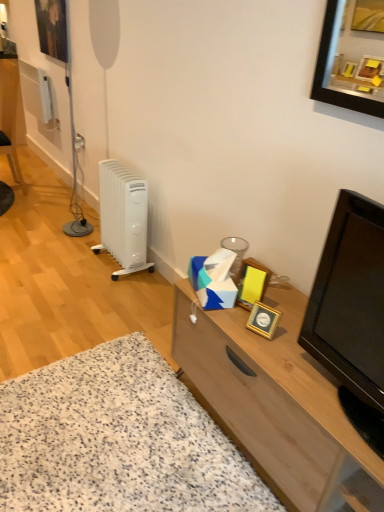
Question: Should I look upward or downward to see white plastic radiator at left?

Choices:
 (A) down
 (B) up

Answer: (B)

Question: Is the position of black glossy television at right less distant than that of white plastic radiator at left?

Choices:
 (A) no
 (B) yes

Answer: (B)

Question: Is black glossy television at right aimed at white plastic radiator at left?

Choices:
 (A) no
 (B) yes

Answer: (A)

Question: Is black glossy television at right not close to white plastic radiator at left?

Choices:
 (A) no
 (B) yes

Answer: (B)

Question: From the image's perspective, is black glossy television at right located beneath white plastic radiator at left?

Choices:
 (A) yes
 (B) no

Answer: (A)

Question: Does black glossy television at right appear on the left side of white plastic radiator at left?

Choices:
 (A) no
 (B) yes

Answer: (A)

Question: Is black glossy television at right further to camera compared to white plastic radiator at left?

Choices:
 (A) no
 (B) yes

Answer: (A)

Question: Is matte black picture frame at upper left, marked as the 1th picture frame in a left-to-right arrangement, facing towards gold metallic picture frame at center-right, the 2th picture frame when ordered from top to bottom?

Choices:
 (A) no
 (B) yes

Answer: (A)

Question: Does matte black picture frame at upper left, which is counted as the 3th picture frame, starting from the bottom, have a smaller size compared to gold metallic picture frame at center-right, the second picture frame in the left-to-right sequence?

Choices:
 (A) yes
 (B) no

Answer: (B)

Question: From the image's perspective, is matte black picture frame at upper left, the first picture frame when ordered from back to front, over gold metallic picture frame at center-right, the second picture frame when ordered from bottom to top?

Choices:
 (A) no
 (B) yes

Answer: (B)

Question: From a real-world perspective, is matte black picture frame at upper left, arranged as the 3th picture frame when viewed from the right, on gold metallic picture frame at center-right, the 2th picture frame when ordered from top to bottom?

Choices:
 (A) no
 (B) yes

Answer: (B)

Question: Does matte black picture frame at upper left, which is counted as the 3th picture frame, starting from the bottom, contain gold metallic picture frame at center-right, the second picture frame from the back?

Choices:
 (A) no
 (B) yes

Answer: (A)

Question: Is matte black picture frame at upper left, acting as the third picture frame starting from the front, positioned before gold metallic picture frame at center-right, the 2th picture frame when ordered from top to bottom?

Choices:
 (A) yes
 (B) no

Answer: (B)

Question: Is wooden cabinet at center outside white plastic radiator at left?

Choices:
 (A) yes
 (B) no

Answer: (A)